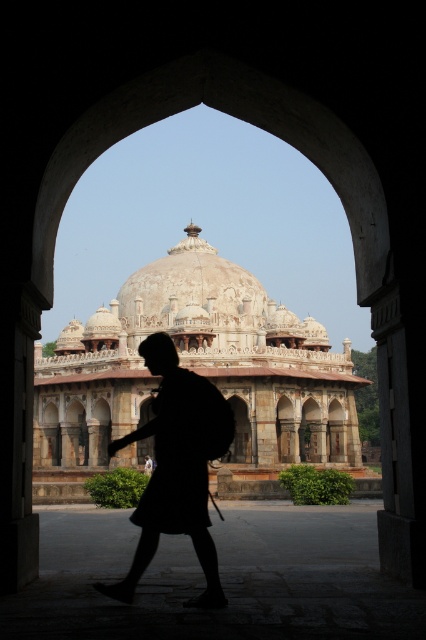
Question: Which of the following is the closest to the observer?

Choices:
 (A) black matte backpack at center
 (B) white stone dome at center

Answer: (A)

Question: Is white stone dome at center bigger than black matte backpack at center?

Choices:
 (A) no
 (B) yes

Answer: (B)

Question: Can you confirm if white stone dome at center is positioned below black matte backpack at center?

Choices:
 (A) no
 (B) yes

Answer: (A)

Question: Is white stone dome at center above black matte backpack at center?

Choices:
 (A) no
 (B) yes

Answer: (B)

Question: Among these objects, which one is nearest to the camera?

Choices:
 (A) white stone dome at center
 (B) black matte backpack at center

Answer: (B)

Question: Which object is closer to the camera taking this photo?

Choices:
 (A) white stone dome at center
 (B) black matte backpack at center

Answer: (B)